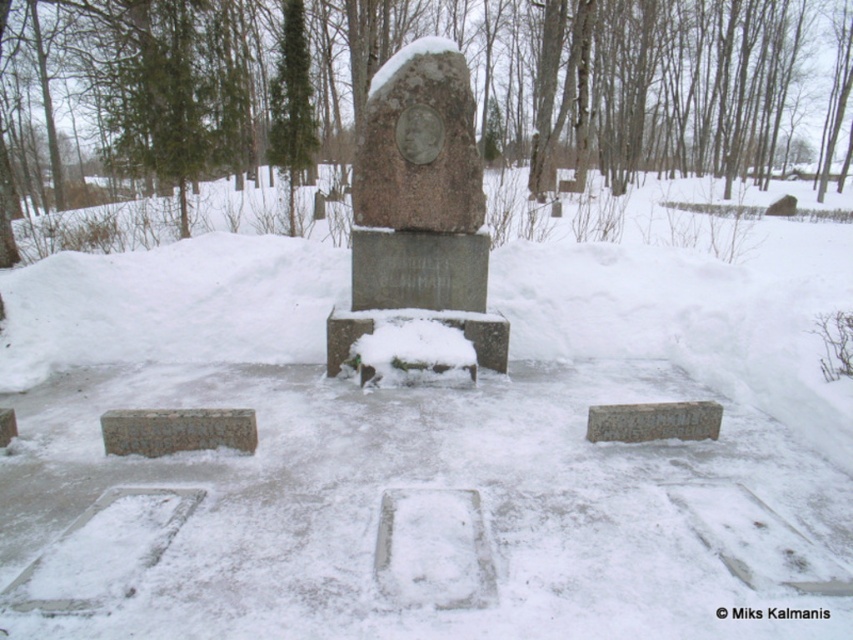
Between gray stone plaque at lower left and gray stone gravestone at lower left, which one appears on the right side from the viewer's perspective?

gray stone plaque at lower left

Who is taller, gray stone plaque at lower left or gray stone gravestone at lower left?

With more height is gray stone plaque at lower left.

Is point (144, 442) less distant than point (4, 426)?

Yes.

This screenshot has width=853, height=640. In order to click on gray stone plaque at lower left in this screenshot , I will do `click(177, 429)`.

Who is more forward, (672, 419) or (10, 429)?

Point (672, 419)

The height and width of the screenshot is (640, 853). What do you see at coordinates (653, 420) in the screenshot?
I see `gray stone plaque at center` at bounding box center [653, 420].

Find the location of a particular element. gray stone plaque at center is located at coordinates (653, 420).

Is point (142, 449) less distant than point (677, 404)?

That is True.

Is gray stone plaque at lower left further to the viewer compared to gray stone plaque at center?

No.

Who is more distant from viewer, (x=160, y=451) or (x=686, y=435)?

The point (x=686, y=435) is more distant.

Where is `gray stone plaque at lower left`? The width and height of the screenshot is (853, 640). gray stone plaque at lower left is located at coordinates (177, 429).